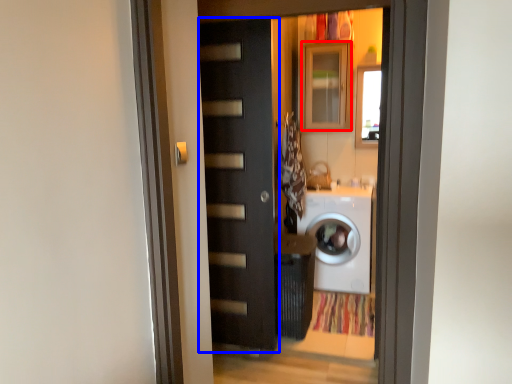
Question: Which point is closer to the camera, cabinetry (highlighted by a red box) or door (highlighted by a blue box)?

Choices:
 (A) cabinetry
 (B) door

Answer: (B)